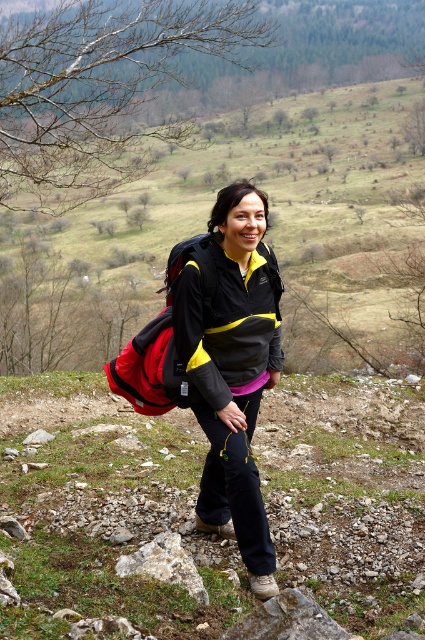
Between black matte jacket at center and gray rough rock at lower center, which one appears on the left side from the viewer's perspective?

From the viewer's perspective, gray rough rock at lower center appears more on the left side.

Does black matte jacket at center have a larger size compared to gray rough rock at lower center?

Correct, black matte jacket at center is larger in size than gray rough rock at lower center.

Is point (204, 529) less distant than point (183, 548)?

That is False.

At what (x,y) coordinates should I click in order to perform the action: click on black matte jacket at center. Please return your answer as a coordinate pair (x, y). Looking at the image, I should click on (231, 365).

Does black matte jacket at center have a smaller size compared to black/yellow fabric jacket at center?

No, black matte jacket at center is not smaller than black/yellow fabric jacket at center.

Is point (226, 330) positioned before point (204, 262)?

No, it is not.

In order to click on black matte jacket at center in this screenshot , I will do `click(231, 365)`.

Who is lower down, black/yellow fabric jacket at center or gray rough rock at lower center?

gray rough rock at lower center

Is black/yellow fabric jacket at center smaller than gray rough rock at lower center?

Incorrect, black/yellow fabric jacket at center is not smaller in size than gray rough rock at lower center.

I want to click on black/yellow fabric jacket at center, so click(220, 321).